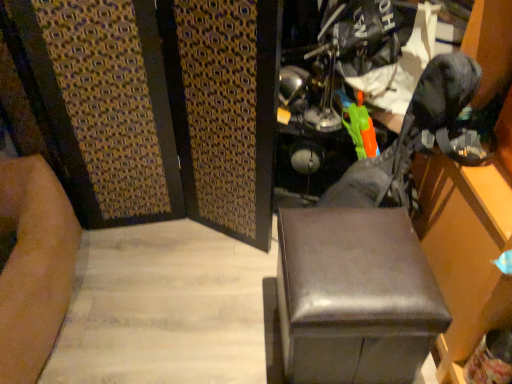
You are a GUI agent. You are given a task and a screenshot of the screen. Output one action in this format:
    pyautogui.click(x=<x>, y=<y>)
    Task: Click on the vacant space situated above shiny brown ottoman at center (from a real-world perspective)
    
    Given the screenshot: What is the action you would take?
    pyautogui.click(x=346, y=253)